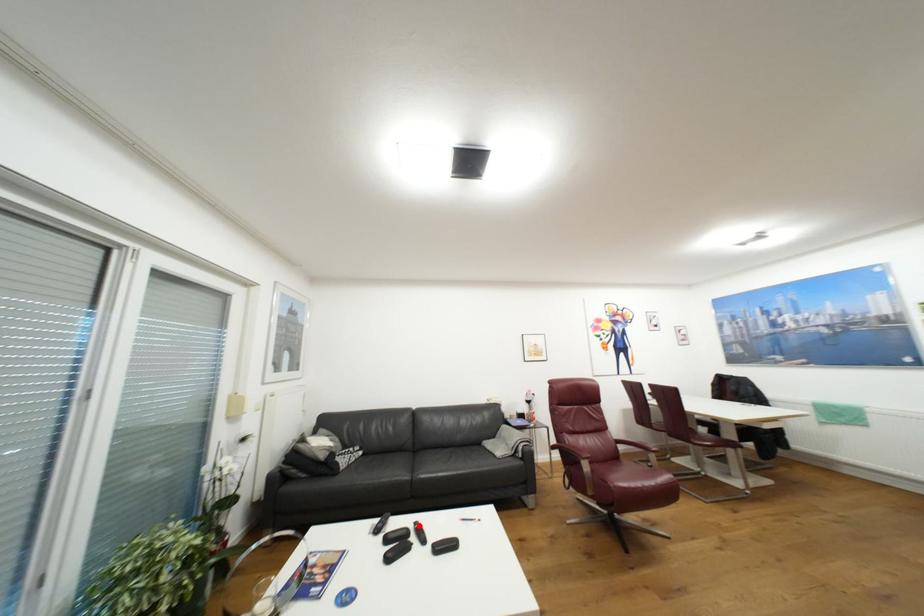
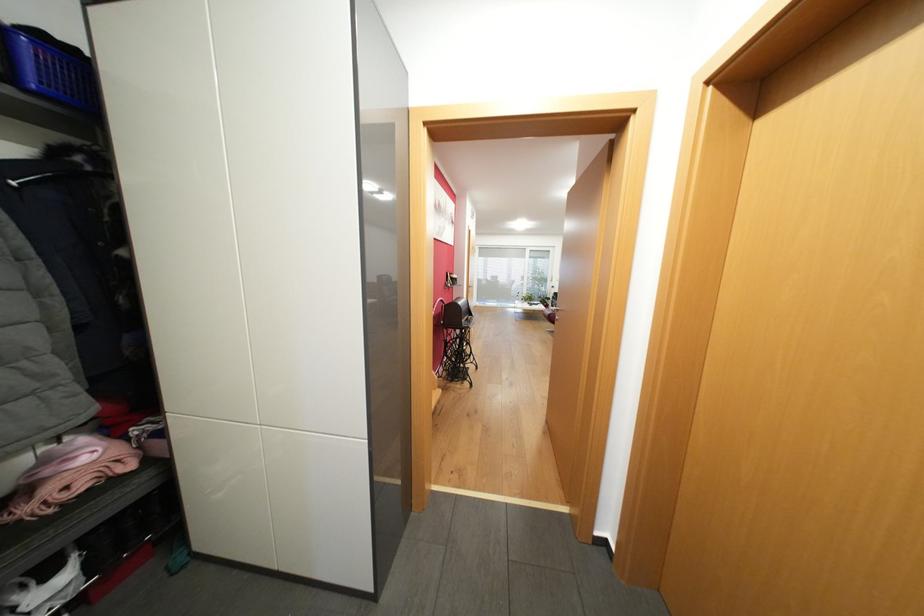
Question: I am providing you with two images of the same scene from different viewpoints. A red point is marked on the first image. Is the red point's position out of view in image 2?

Choices:
 (A) Yes
 (B) No

Answer: (A)